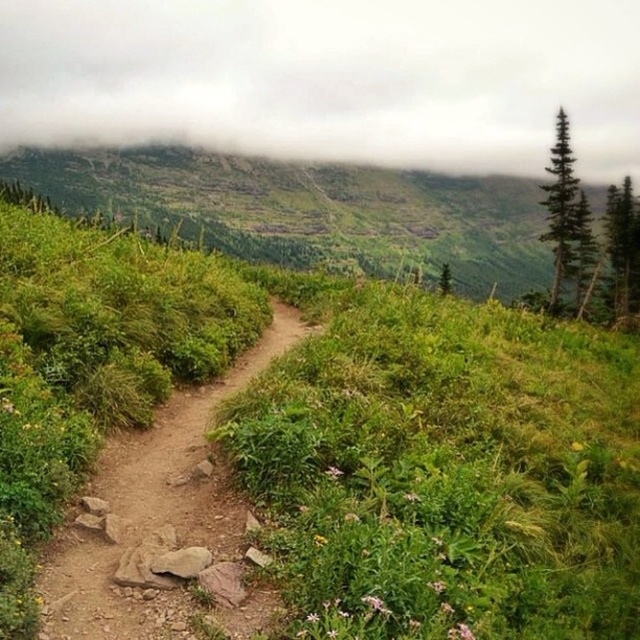
Question: Based on their relative distances, which object is nearer to the green leafy grass at center?

Choices:
 (A) white fluffy cloud at upper center
 (B) dirt path at center
 (C) green textured pine at right

Answer: (B)

Question: Can you confirm if green grassy hillside at lower left is positioned below green textured pine at right?

Choices:
 (A) yes
 (B) no

Answer: (B)

Question: Can you confirm if green leafy grass at center is thinner than dirt path at center?

Choices:
 (A) no
 (B) yes

Answer: (A)

Question: Which of the following is the farthest from the observer?

Choices:
 (A) green grassy hillside at lower left
 (B) green needle-like tree at upper right
 (C) green leafy grass at center
 (D) white fluffy cloud at upper center

Answer: (A)

Question: Which of these objects is positioned closest to the green needle-like tree at upper right?

Choices:
 (A) green leafy grass at center
 (B) dirt path at center

Answer: (A)

Question: Does green leafy grass at center have a larger size compared to green needle-like tree at upper right?

Choices:
 (A) yes
 (B) no

Answer: (B)